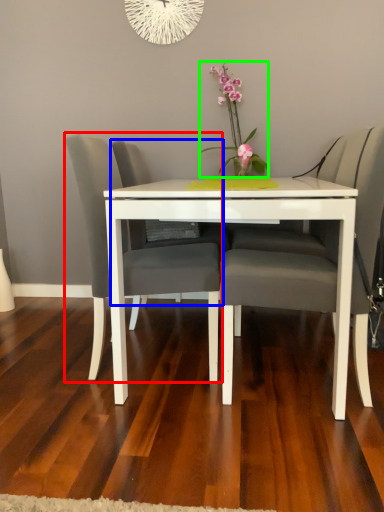
Question: Which is nearer to the chair (highlighted by a red box)? swivel chair (highlighted by a blue box) or floral arrangement (highlighted by a green box).

Choices:
 (A) swivel chair
 (B) floral arrangement

Answer: (A)